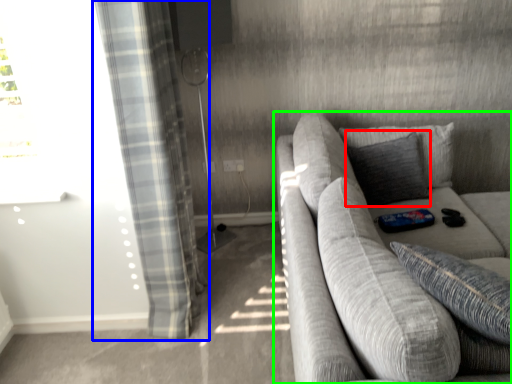
Question: Which object is the farthest from pillow (highlighted by a red box)? Choose among these: curtain (highlighted by a blue box) or studio couch (highlighted by a green box).

Choices:
 (A) curtain
 (B) studio couch

Answer: (A)